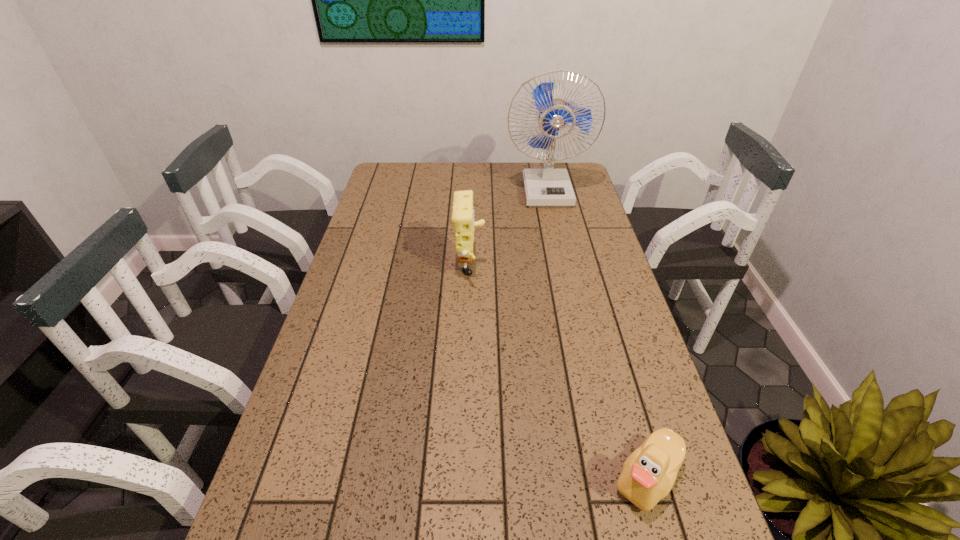
You are a GUI agent. You are given a task and a screenshot of the screen. Output one action in this format:
    pyautogui.click(x=<x>, y=<y>)
    Task: Click on the tallest object
    Image resolution: width=960 pixels, height=540 pixels.
    Given the screenshot: What is the action you would take?
    pyautogui.click(x=547, y=187)

You are a GUI agent. You are given a task and a screenshot of the screen. Output one action in this format:
    pyautogui.click(x=<x>, y=<y>)
    Task: Click on the farthest object
    
    Given the screenshot: What is the action you would take?
    pyautogui.click(x=547, y=187)

What are the coordinates of `the second nearest object` in the screenshot? It's located at pos(463,215).

This screenshot has height=540, width=960. Identify the location of sponge. (463, 215).

Locate an element on the screen. duck is located at coordinates (649, 473).

At what (x,y) coordinates should I click in order to perform the action: click on the nearest object. Please return your answer as a coordinate pair (x, y). Image resolution: width=960 pixels, height=540 pixels. Looking at the image, I should click on (649, 473).

At what (x,y) coordinates should I click in order to perform the action: click on blank space located 0.270m on the front-facing side of the fan. Please return your answer as a coordinate pair (x, y). The width and height of the screenshot is (960, 540). Looking at the image, I should click on (560, 255).

At what (x,y) coordinates should I click in order to perform the action: click on free spot located 0.290m on the face of the second tallest object. Please return your answer as a coordinate pair (x, y). This screenshot has width=960, height=540. Looking at the image, I should click on (582, 272).

Where is `free spot located 0.180m at the beak of the nearest object`? free spot located 0.180m at the beak of the nearest object is located at coordinates (518, 478).

Where is `vacant space located 0.350m at the beak of the nearest object`? This screenshot has width=960, height=540. vacant space located 0.350m at the beak of the nearest object is located at coordinates (431, 478).